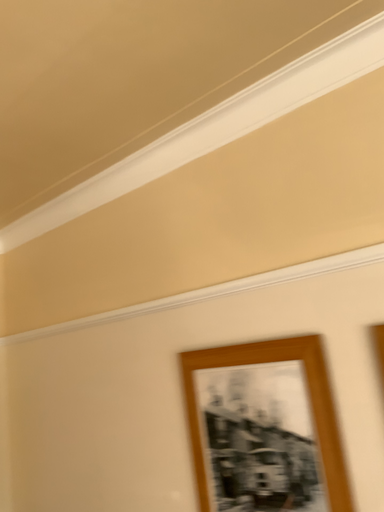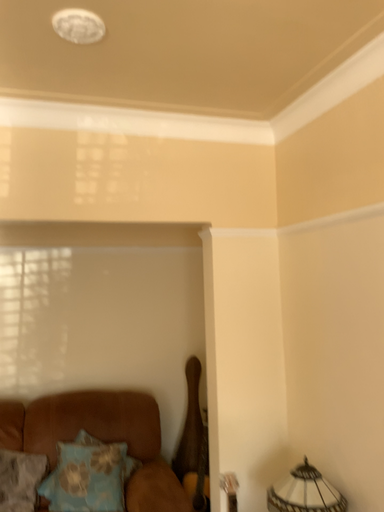
Question: Which way did the camera rotate in the video?

Choices:
 (A) rotated right
 (B) rotated left

Answer: (B)